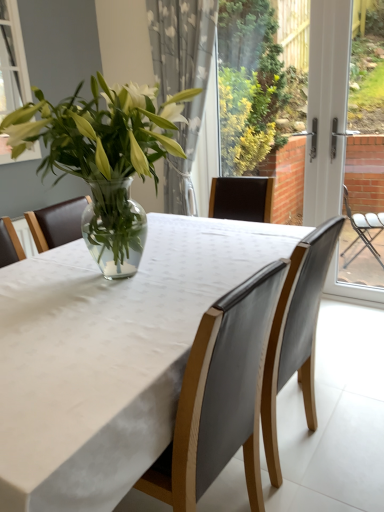
Question: From a real-world perspective, does white plastic screen door at right sit lower than leather chair at center, the 1th chair in the right-to-left sequence?

Choices:
 (A) yes
 (B) no

Answer: (B)

Question: Is white plastic screen door at right turned away from leather chair at center, the 1th chair in the right-to-left sequence?

Choices:
 (A) yes
 (B) no

Answer: (B)

Question: Could you tell me if white plastic screen door at right is facing leather chair at center, the second chair viewed from the left?

Choices:
 (A) yes
 (B) no

Answer: (A)

Question: From the image's perspective, would you say white plastic screen door at right is shown under leather chair at center, the second chair viewed from the left?

Choices:
 (A) no
 (B) yes

Answer: (A)

Question: From a real-world perspective, does white plastic screen door at right stand above leather chair at center, the second chair viewed from the left?

Choices:
 (A) yes
 (B) no

Answer: (A)

Question: Looking at the image, does white plastic screen door at right seem bigger or smaller compared to white fabric table at center?

Choices:
 (A) small
 (B) big

Answer: (A)

Question: Is white plastic screen door at right taller or shorter than white fabric table at center?

Choices:
 (A) short
 (B) tall

Answer: (B)

Question: Would you say white plastic screen door at right is to the left or to the right of white fabric table at center in the picture?

Choices:
 (A) right
 (B) left

Answer: (A)

Question: Is white plastic screen door at right in front of or behind white fabric table at center in the image?

Choices:
 (A) behind
 (B) front

Answer: (A)

Question: In terms of height, does white sheer curtain at upper center look taller or shorter compared to white plastic screen door at right?

Choices:
 (A) short
 (B) tall

Answer: (A)

Question: Would you say white sheer curtain at upper center is to the left or to the right of white plastic screen door at right in the picture?

Choices:
 (A) right
 (B) left

Answer: (B)

Question: Considering the positions of white sheer curtain at upper center and white plastic screen door at right in the image, is white sheer curtain at upper center wider or thinner than white plastic screen door at right?

Choices:
 (A) wide
 (B) thin

Answer: (A)

Question: In terms of size, does white sheer curtain at upper center appear bigger or smaller than white plastic screen door at right?

Choices:
 (A) big
 (B) small

Answer: (A)

Question: Is matte gray chair at center, the second chair from the right, inside or outside of white plastic screen door at right?

Choices:
 (A) inside
 (B) outside

Answer: (B)

Question: Looking at their shapes, would you say matte gray chair at center, the second chair from the right, is wider or thinner than white plastic screen door at right?

Choices:
 (A) thin
 (B) wide

Answer: (B)